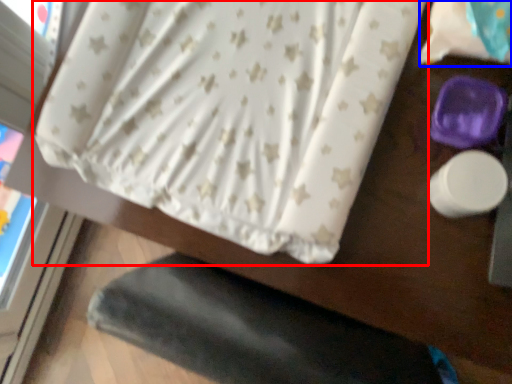
Question: Which object appears farthest to the camera in this image, curtain (highlighted by a red box) or sheet (highlighted by a blue box)?

Choices:
 (A) curtain
 (B) sheet

Answer: (A)